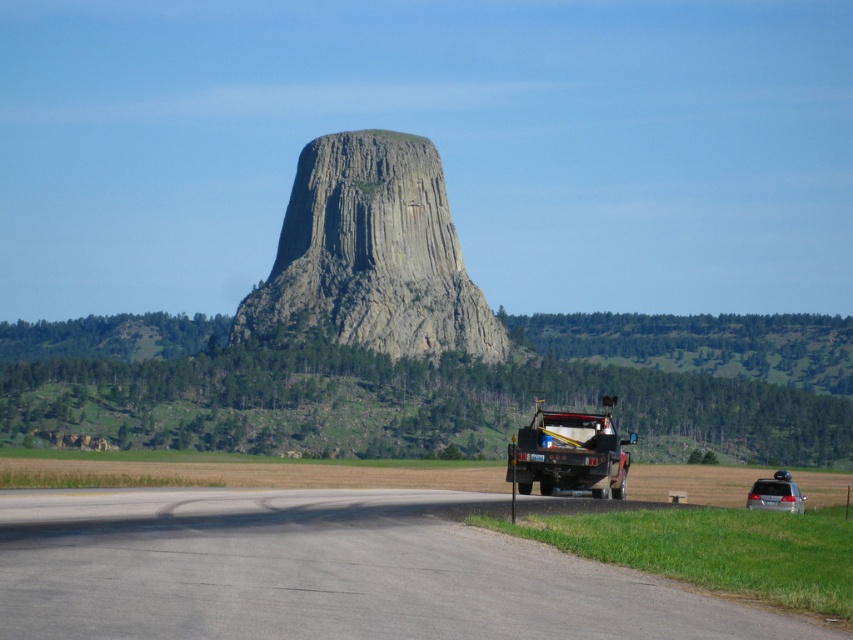
Based on the photo, you are a photographer positioned at the base of Devil s Tower. You want to capture a shot that includes both the gray asphalt highway at center and the satin silver sedan at lower right. Which object should be placed higher in the frame to ensure both are visible?

The gray asphalt highway at center should be placed higher in the frame because it is above the satin silver sedan at lower right, allowing both to be captured in the shot.

You are a photographer planning to capture the gray asphalt highway at center and the satin silver sedan at lower right in a single frame. Considering their sizes in the image, which object will appear larger in your photo?

The gray asphalt highway at center will appear larger in the photo because it is much taller than the satin silver sedan at lower right.